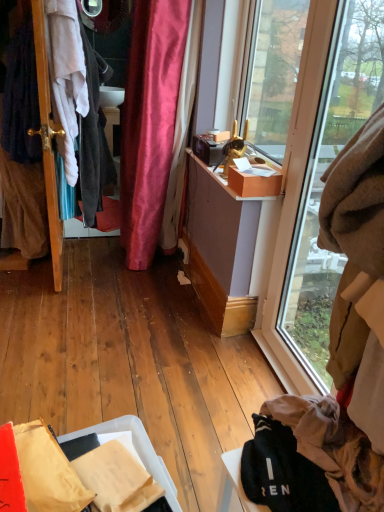
Describe the element at coordinates (273, 73) in the screenshot. The image size is (384, 512). I see `matte brown box at upper right` at that location.

The height and width of the screenshot is (512, 384). What are the coordinates of `clear glass window at right` in the screenshot? It's located at [318, 185].

Where is `brown fuzzy blanket at upper right, the 2th clothing positioned from the back`? This screenshot has height=512, width=384. brown fuzzy blanket at upper right, the 2th clothing positioned from the back is located at coordinates (358, 275).

Considering the positions of objects clear glass window at right and wooden door at left in the image provided, who is more to the left, clear glass window at right or wooden door at left?

wooden door at left.

What's the angular difference between clear glass window at right and wooden door at left's facing directions?

clear glass window at right and wooden door at left are facing 88.8 degrees away from each other.

Is clear glass window at right shorter than wooden door at left?

Yes.

Is clear glass window at right behind wooden door at left?

No, it is not.

Does brown fuzzy blanket at upper right, marked as the first clothing in a front-to-back arrangement, have a smaller size compared to clear glass window at right?

Yes, brown fuzzy blanket at upper right, marked as the first clothing in a front-to-back arrangement, is smaller than clear glass window at right.

In the image, is brown fuzzy blanket at upper right, the second clothing from the left, on the left side or the right side of clear glass window at right?

Clearly, brown fuzzy blanket at upper right, the second clothing from the left, is on the left of clear glass window at right in the image.

From the picture: From a real-world perspective, which is physically above, brown fuzzy blanket at upper right, the 1th clothing when ordered from bottom to top, or clear glass window at right?

clear glass window at right is physically above.

At what (x,y) coordinates should I click in order to perform the action: click on box below the dark gray fabric at left, which appears as the second clothing when ordered from the bottom (from the image's perspective). Please return your answer as a coordinate pair (x, y). The height and width of the screenshot is (512, 384). Looking at the image, I should click on (254, 183).

Considering the relative sizes of dark gray fabric at left, marked as the first clothing in a back-to-front arrangement, and matte cardboard box at upper right in the image provided, is dark gray fabric at left, marked as the first clothing in a back-to-front arrangement, smaller than matte cardboard box at upper right?

Incorrect, dark gray fabric at left, marked as the first clothing in a back-to-front arrangement, is not smaller in size than matte cardboard box at upper right.

Would you consider dark gray fabric at left, which is counted as the 2th clothing, starting from the right, to be distant from matte cardboard box at upper right?

dark gray fabric at left, which is counted as the 2th clothing, starting from the right, is actually quite close to matte cardboard box at upper right.

At what (x,y) coordinates should I click in order to perform the action: click on box located below the wooden door at left (from the image's perspective). Please return your answer as a coordinate pair (x, y). Looking at the image, I should click on (254, 183).

How different are the orientations of matte cardboard box at upper right and wooden door at left in degrees?

The angle between the facing direction of matte cardboard box at upper right and the facing direction of wooden door at left is 89.7 degrees.

From the image's perspective, would you say matte cardboard box at upper right is positioned over wooden door at left?

No, from the image's perspective, matte cardboard box at upper right is not on top of wooden door at left.

Considering the positions of objects matte cardboard box at upper right and wooden door at left in the image provided, who is more to the left, matte cardboard box at upper right or wooden door at left?

wooden door at left is more to the left.

From a real-world perspective, is matte cardboard box at upper right over brown fuzzy blanket at upper right, the 1th clothing when ordered from bottom to top?

Actually, matte cardboard box at upper right is physically below brown fuzzy blanket at upper right, the 1th clothing when ordered from bottom to top, in the real world.

Considering the sizes of objects matte cardboard box at upper right and brown fuzzy blanket at upper right, the 1th clothing when ordered from bottom to top, in the image provided, who is thinner, matte cardboard box at upper right or brown fuzzy blanket at upper right, the 1th clothing when ordered from bottom to top,?

Thinner between the two is brown fuzzy blanket at upper right, the 1th clothing when ordered from bottom to top.

Is matte cardboard box at upper right inside the boundaries of brown fuzzy blanket at upper right, marked as the first clothing in a front-to-back arrangement, or outside?

matte cardboard box at upper right cannot be found inside brown fuzzy blanket at upper right, marked as the first clothing in a front-to-back arrangement.

From the image's perspective, which one is positioned lower, clear glass window at right or dark gray fabric at left, marked as the first clothing in a back-to-front arrangement?

clear glass window at right.

Is point (311, 155) in front of point (69, 141)?

Yes, point (311, 155) is in front of point (69, 141).

At what (x,y) coordinates should I click in order to perform the action: click on the 2nd clothing behind the clear glass window at right. Please return your answer as a coordinate pair (x, y). The height and width of the screenshot is (512, 384). Looking at the image, I should click on (78, 105).

From the picture: How different are the orientations of clear glass window at right and dark gray fabric at left, which appears as the second clothing when ordered from the bottom, in degrees?

89.4 degrees.

Is matte brown box at upper right surrounding matte cardboard box at upper right?

No, matte cardboard box at upper right is not surrounded by matte brown box at upper right.

How far apart are matte brown box at upper right and matte cardboard box at upper right?

A distance of 33.12 inches exists between matte brown box at upper right and matte cardboard box at upper right.

In terms of size, does matte brown box at upper right appear bigger or smaller than matte cardboard box at upper right?

Considering their sizes, matte brown box at upper right takes up more space than matte cardboard box at upper right.

Which is behind, point (282, 79) or point (240, 175)?

The point (282, 79) is more distant.

At what (x,y) coordinates should I click in order to perform the action: click on window on the right of wooden door at left. Please return your answer as a coordinate pair (x, y). The width and height of the screenshot is (384, 512). Looking at the image, I should click on (318, 185).

Find the location of `clothing that is the 1st object located behind the clear glass window at right`. clothing that is the 1st object located behind the clear glass window at right is located at coordinates (358, 275).

When comparing their distances from matte brown box at upper right, does brown fuzzy blanket at upper right, which is the first clothing from right to left, or dark gray fabric at left, marked as the 1th clothing in a left-to-right arrangement, seem further?

brown fuzzy blanket at upper right, which is the first clothing from right to left, is further to matte brown box at upper right.

Considering their positions, is matte brown box at upper right positioned closer to clear glass window at right than dark gray fabric at left, marked as the first clothing in a back-to-front arrangement?

matte brown box at upper right lies closer to clear glass window at right than the other object.

Based on the photo, estimate the real-world distances between objects in this image. Which object is closer to wooden door at left, matte brown box at upper right or matte cardboard box at upper right?

matte cardboard box at upper right lies closer to wooden door at left than the other object.

Based on their spatial positions, is matte brown box at upper right or wooden door at left closer to brown fuzzy blanket at upper right, which is the first clothing from right to left?

Based on the image, wooden door at left appears to be nearer to brown fuzzy blanket at upper right, which is the first clothing from right to left.

Based on the photo, which object lies further to the anchor point matte cardboard box at upper right, dark gray fabric at left, marked as the first clothing in a back-to-front arrangement, or clear glass window at right?

dark gray fabric at left, marked as the first clothing in a back-to-front arrangement, is further to matte cardboard box at upper right.

Consider the image. Which object lies nearer to the anchor point dark gray fabric at left, which appears as the second clothing when ordered from the bottom, wooden door at left or matte brown box at upper right?

Among the two, wooden door at left is located nearer to dark gray fabric at left, which appears as the second clothing when ordered from the bottom.

Looking at the image, which one is located closer to wooden door at left, matte cardboard box at upper right or clear glass window at right?

matte cardboard box at upper right lies closer to wooden door at left than the other object.

From the image, which object appears to be nearer to dark gray fabric at left, which appears as the second clothing when ordered from the bottom, matte brown box at upper right or clear glass window at right?

Among the two, matte brown box at upper right is located nearer to dark gray fabric at left, which appears as the second clothing when ordered from the bottom.

The image size is (384, 512). I want to click on box between brown fuzzy blanket at upper right, the second clothing from the top, and dark gray fabric at left, marked as the first clothing in a back-to-front arrangement, from front to back, so click(254, 183).

Identify the location of box located between clear glass window at right and dark gray fabric at left, marked as the first clothing in a back-to-front arrangement, in the depth direction. (254, 183).

This screenshot has height=512, width=384. Find the location of `window screen between clear glass window at right and dark gray fabric at left, which appears as the second clothing when ordered from the bottom, along the z-axis`. window screen between clear glass window at right and dark gray fabric at left, which appears as the second clothing when ordered from the bottom, along the z-axis is located at coordinates tap(273, 73).

This screenshot has height=512, width=384. I want to click on box between wooden door at left and clear glass window at right, so click(254, 183).